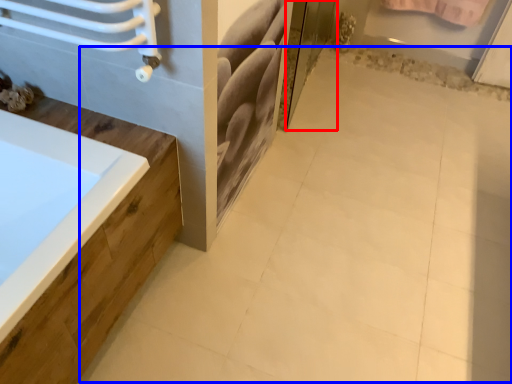
Question: Which of the following is the closest to the observer, screen door (highlighted by a red box) or ceramic tile (highlighted by a blue box)?

Choices:
 (A) screen door
 (B) ceramic tile

Answer: (B)